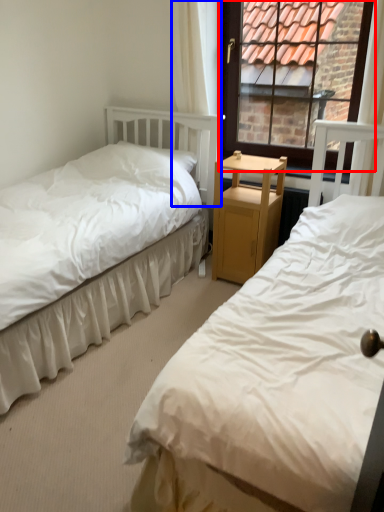
Question: Which of the following is the closest to the observer, window (highlighted by a red box) or curtain (highlighted by a blue box)?

Choices:
 (A) window
 (B) curtain

Answer: (A)